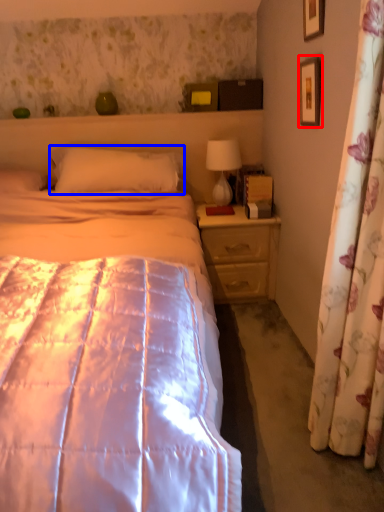
Question: Among these objects, which one is nearest to the camera, picture frame (highlighted by a red box) or pillow (highlighted by a blue box)?

Choices:
 (A) picture frame
 (B) pillow

Answer: (A)